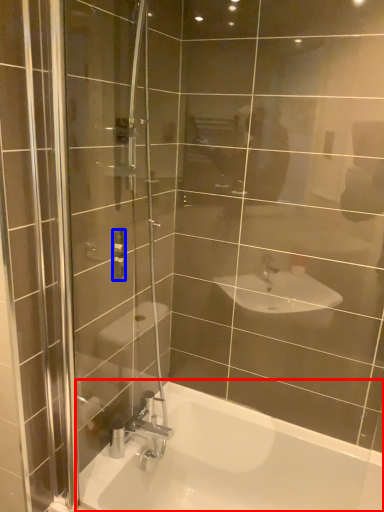
Question: Which object is further to the camera taking this photo, bathtub (highlighted by a red box) or shower (highlighted by a blue box)?

Choices:
 (A) bathtub
 (B) shower

Answer: (B)